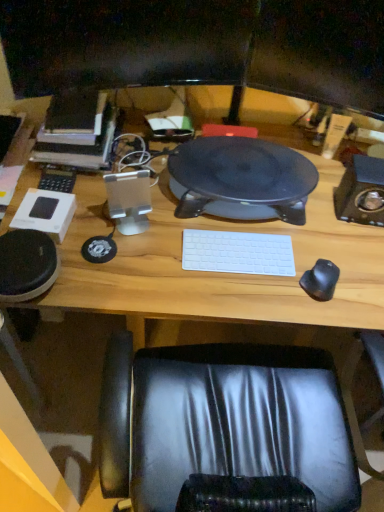
Where is `free space above wooden computer desk at center (from a real-world perspective)`? This screenshot has height=512, width=384. free space above wooden computer desk at center (from a real-world perspective) is located at coordinates (247, 220).